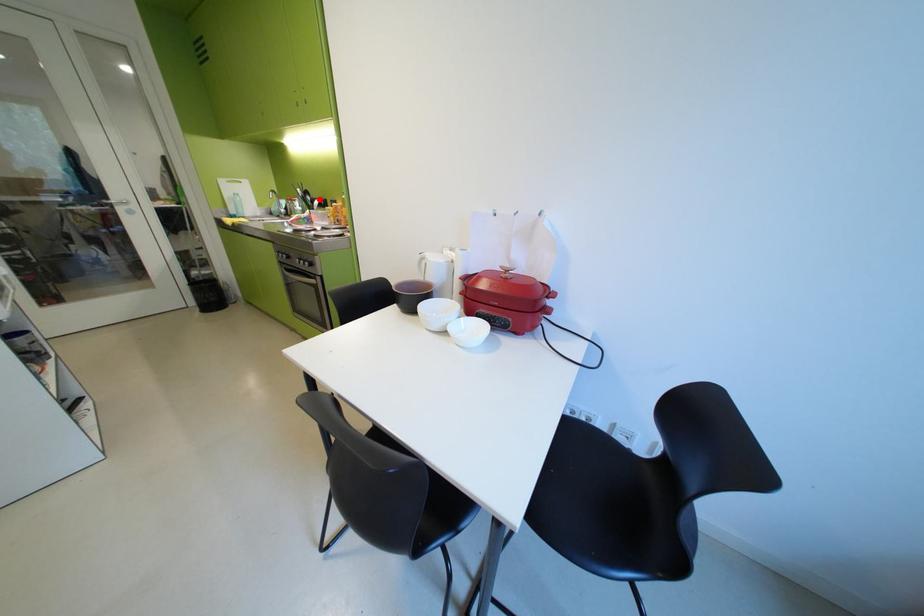
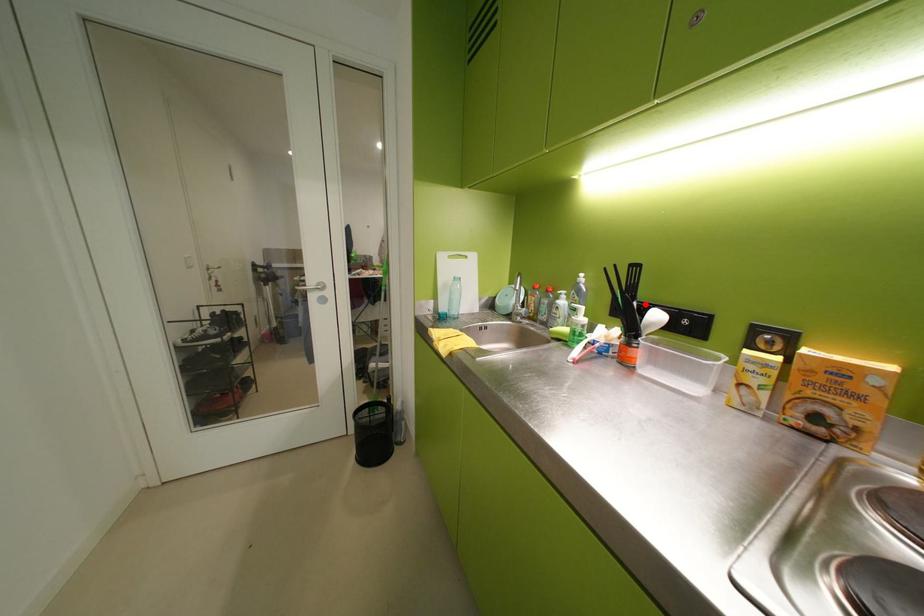
I am providing you with two images of the same scene from different viewpoints. A red point is marked on the first image and another point is marked on the second image. Are the points marked in image1 and image2 representing the same 3D position?

Yes